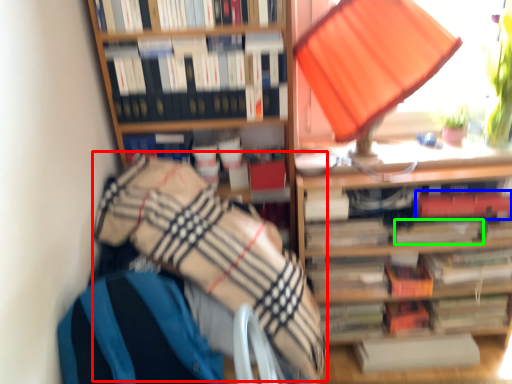
Question: Considering the real-world distances, which object is farthest from blanket (highlighted by a red box)? paperback book (highlighted by a blue box) or paperback book (highlighted by a green box)?

Choices:
 (A) paperback book
 (B) paperback book

Answer: (A)